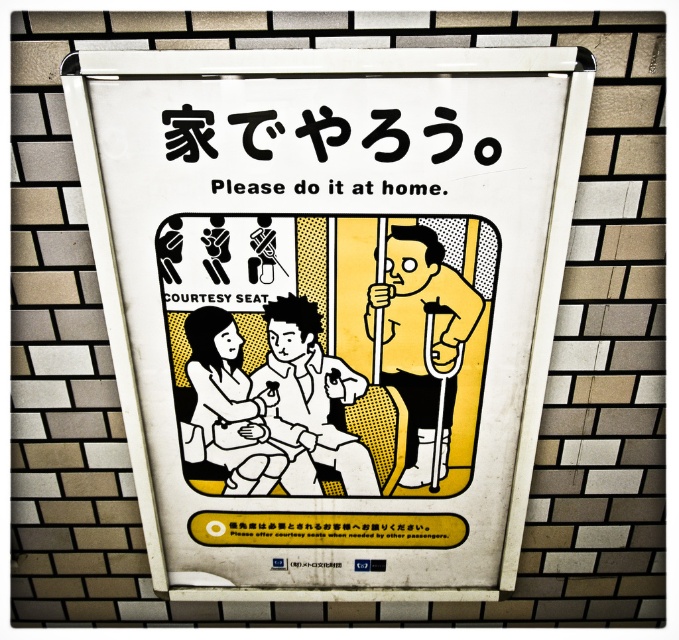
Question: Can you confirm if white paper sign at center is positioned above white matte shirt at center?

Choices:
 (A) yes
 (B) no

Answer: (A)

Question: Which of the following is the farthest from the observer?

Choices:
 (A) white matte shirt at center
 (B) white paper sign at center

Answer: (A)

Question: Does white paper sign at center have a larger size compared to yellow matte crutches at center?

Choices:
 (A) yes
 (B) no

Answer: (A)

Question: Can you confirm if yellow matte crutches at center is positioned to the left of white matte shirt at center?

Choices:
 (A) no
 (B) yes

Answer: (A)

Question: Which point is closer to the camera taking this photo?

Choices:
 (A) (246, 390)
 (B) (316, 480)
 (C) (407, 365)
 (D) (275, 128)

Answer: (D)

Question: Which object is positioned closest to the white paper sign at center?

Choices:
 (A) matte white dress at lower left
 (B) yellow matte crutches at center

Answer: (B)